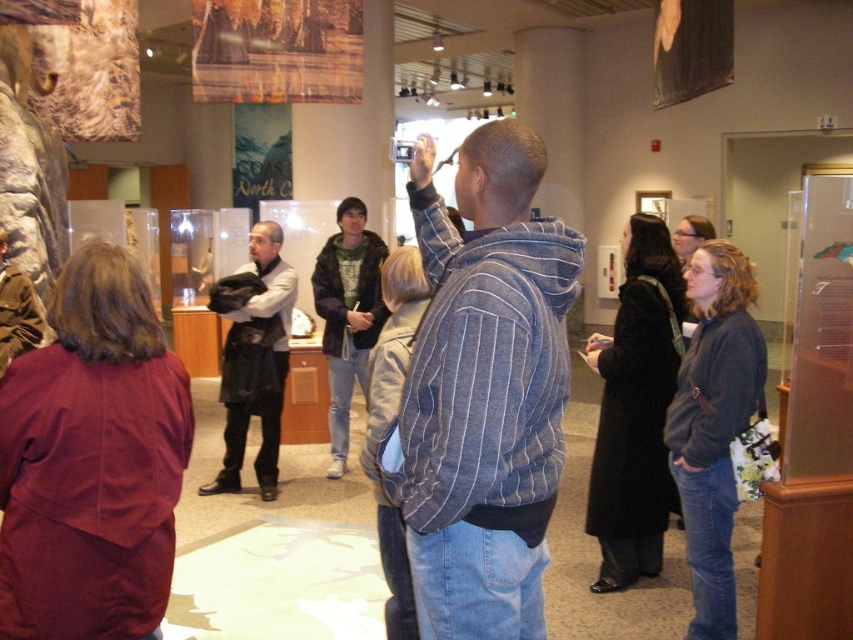
Can you confirm if striped denim jacket at center is positioned to the left of green hoodie at center?

No, striped denim jacket at center is not to the left of green hoodie at center.

Find the location of a particular element. striped denim jacket at center is located at coordinates (483, 392).

Image resolution: width=853 pixels, height=640 pixels. What do you see at coordinates (483, 392) in the screenshot?
I see `striped denim jacket at center` at bounding box center [483, 392].

Identify the location of striped denim jacket at center. This screenshot has height=640, width=853. (483, 392).

Is striped denim jacket at center shorter than dark gray fabric jacket at center?

Indeed, striped denim jacket at center has a lesser height compared to dark gray fabric jacket at center.

Between striped denim jacket at center and dark gray fabric jacket at center, which one appears on the right side from the viewer's perspective?

Positioned to the right is striped denim jacket at center.

Is point (421, 225) behind point (253, 358)?

That is False.

This screenshot has height=640, width=853. I want to click on striped denim jacket at center, so click(483, 392).

Where is `dark gray fabric jacket at center`? dark gray fabric jacket at center is located at coordinates (254, 356).

Does point (264, 362) come in front of point (349, 346)?

Yes, point (264, 362) is in front of point (349, 346).

The width and height of the screenshot is (853, 640). Identify the location of dark gray fabric jacket at center. (254, 356).